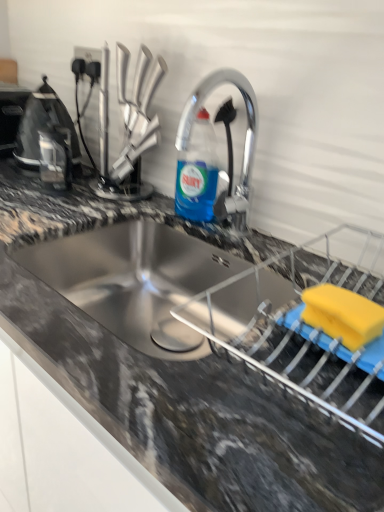
Question: Can you confirm if blue translucent liquid at center is wider than black plastic kettle at left, arranged as the 2th appliance when viewed from the back?

Choices:
 (A) yes
 (B) no

Answer: (B)

Question: Is blue translucent liquid at center positioned with its back to black plastic kettle at left, which appears as the second appliance when viewed from the left?

Choices:
 (A) no
 (B) yes

Answer: (A)

Question: Considering the relative sizes of blue translucent liquid at center and black plastic kettle at left, the 2th appliance from the top, in the image provided, is blue translucent liquid at center smaller than black plastic kettle at left, the 2th appliance from the top,?

Choices:
 (A) yes
 (B) no

Answer: (A)

Question: Would you say blue translucent liquid at center is outside black plastic kettle at left, which appears as the second appliance when viewed from the left?

Choices:
 (A) no
 (B) yes

Answer: (B)

Question: From the image's perspective, does blue translucent liquid at center appear higher than black plastic kettle at left, the second appliance from the bottom?

Choices:
 (A) no
 (B) yes

Answer: (A)

Question: From their relative heights in the image, would you say black plastic kettle at left, acting as the second appliance starting from the front, is taller or shorter than black plastic toaster at left, which is the 3th appliance from front to back?

Choices:
 (A) short
 (B) tall

Answer: (B)

Question: Would you say black plastic kettle at left, which appears as the second appliance when viewed from the left, is to the left or to the right of black plastic toaster at left, placed as the 1th appliance when sorted from top to bottom, in the picture?

Choices:
 (A) right
 (B) left

Answer: (A)

Question: From a real-world perspective, is black plastic kettle at left, the second appliance from the bottom, positioned above or below black plastic toaster at left, positioned as the first appliance in back-to-front order?

Choices:
 (A) below
 (B) above

Answer: (B)

Question: Is black plastic kettle at left, arranged as the 2th appliance when viewed from the right, situated inside black plastic toaster at left, placed as the 1th appliance when sorted from top to bottom, or outside?

Choices:
 (A) inside
 (B) outside

Answer: (B)

Question: Considering the positions of metallic silver faucet at upper center and granite gray countertop at center in the image, is metallic silver faucet at upper center bigger or smaller than granite gray countertop at center?

Choices:
 (A) small
 (B) big

Answer: (A)

Question: Considering the relative positions of metallic silver faucet at upper center and granite gray countertop at center in the image provided, is metallic silver faucet at upper center to the left or to the right of granite gray countertop at center?

Choices:
 (A) left
 (B) right

Answer: (B)

Question: Is point (226, 131) positioned closer to the camera than point (205, 419)?

Choices:
 (A) farther
 (B) closer

Answer: (A)

Question: Considering the positions of metallic silver faucet at upper center and granite gray countertop at center in the image, is metallic silver faucet at upper center wider or thinner than granite gray countertop at center?

Choices:
 (A) thin
 (B) wide

Answer: (A)

Question: Would you say yellow sponge at lower right, the first appliance positioned from the front, is to the left or to the right of black plastic toaster at left, which is the 3th appliance from front to back, in the picture?

Choices:
 (A) right
 (B) left

Answer: (A)

Question: Relative to black plastic toaster at left, acting as the third appliance starting from the bottom, is yellow sponge at lower right, positioned as the 1th appliance in bottom-to-top order, in front or behind?

Choices:
 (A) behind
 (B) front

Answer: (B)